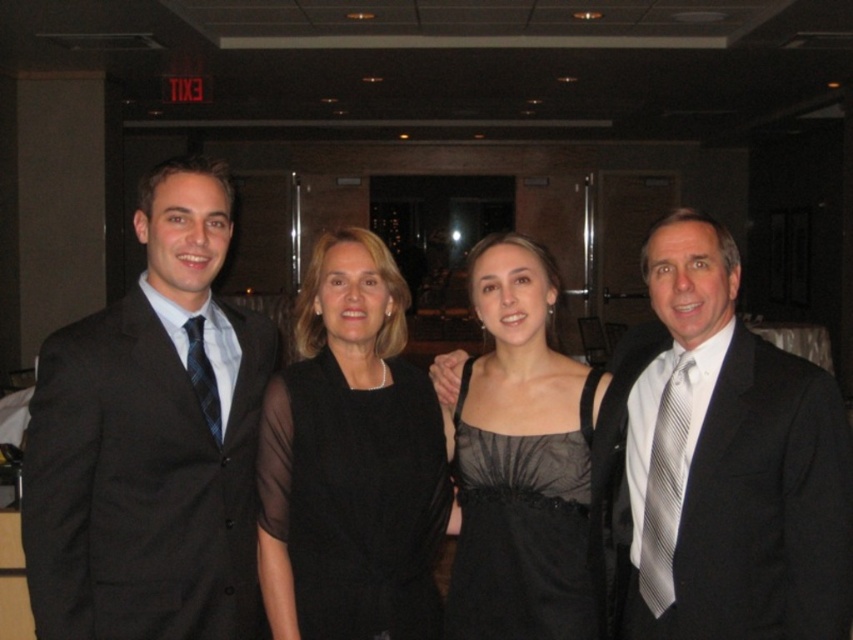
Based on the photo, you are a photographer adjusting the lighting for the group photo. You need to position a spotlight so it illuminates both the black sheer dress at center and the blue striped tie at left without causing glare on the glass door. Based on their positions, which object should be placed closer to the glass door to avoid glare?

The black sheer dress at center should be placed closer to the glass door because it is to the right of the blue striped tie at left, so positioning it nearer to the door would help avoid glare reflecting back into the camera.

You are a photographer adjusting the lighting for a group photo. You notice the black satin dress at center and the gray striped tie at right. Which clothing item requires more space to avoid being cut off in the frame?

The black satin dress at center requires more space because its width surpasses that of the gray striped tie at right.